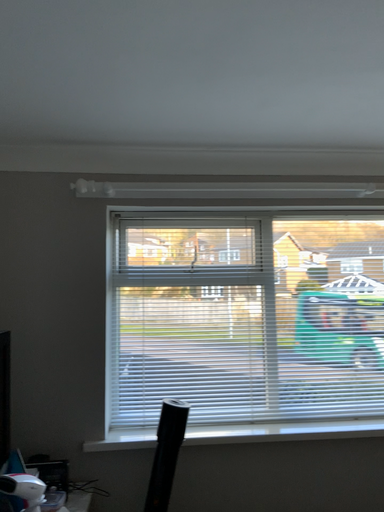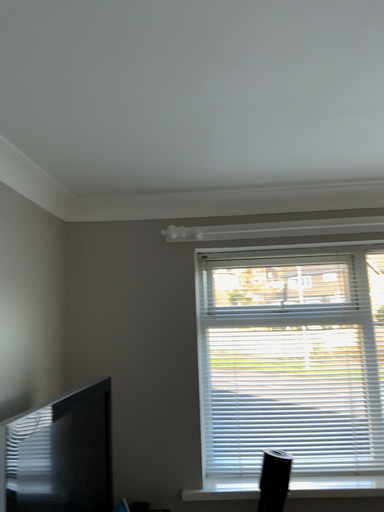
Question: Which way did the camera rotate in the video?

Choices:
 (A) rotated left
 (B) rotated right

Answer: (A)